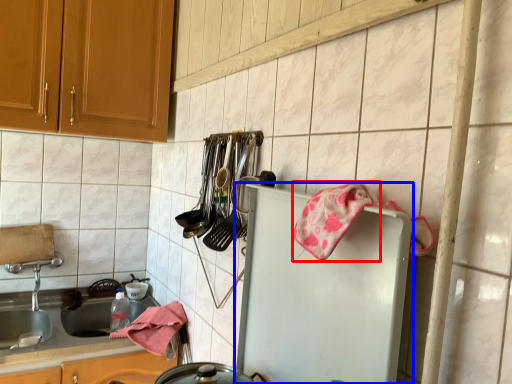
Question: Which object is closer to the camera taking this photo, material (highlighted by a red box) or refrigerator (highlighted by a blue box)?

Choices:
 (A) material
 (B) refrigerator

Answer: (B)